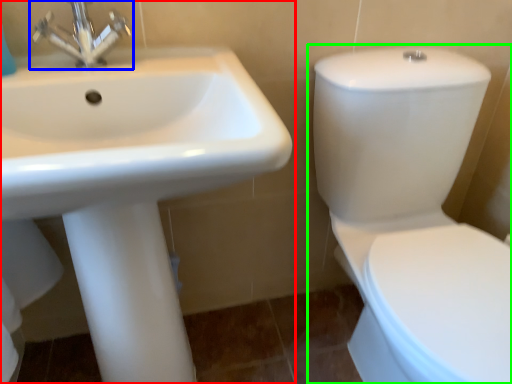
Question: Considering the real-world distances, which object is farthest from sink (highlighted by a red box)? tap (highlighted by a blue box) or toilet (highlighted by a green box)?

Choices:
 (A) tap
 (B) toilet

Answer: (B)